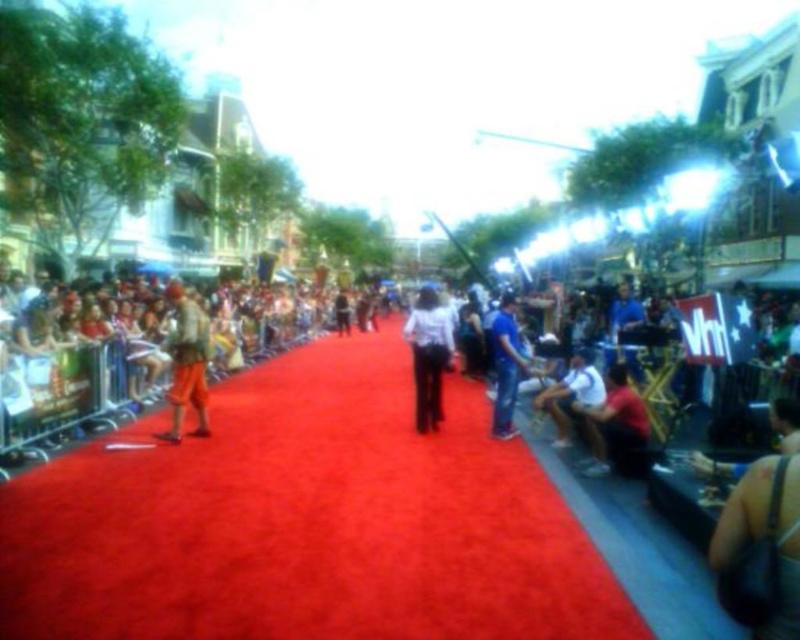
You are a photographer at the event and want to capture a photo of both the white matte dress at center and the white cotton shirt at center. Since the red carpet is narrow, you need to ensure both subjects can stand side by side without overlapping. Can they fit if the red carpet is 1.8 meters wide?

The white matte dress at center has a larger width than the white cotton shirt at center. However, without knowing the exact widths of both items, it is impossible to determine if they can fit side by side on the 1.8 meter wide red carpet.

You are standing at the event and want to take a photo of the matte white shirt at lower right. If your camera has a maximum focus range of 25 feet, will you be able to capture a clear photo without moving closer?

The matte white shirt at lower right is 27.19 feet away from you. Since your camera can only focus up to 25 feet, you will not be able to capture a clear photo without moving closer.